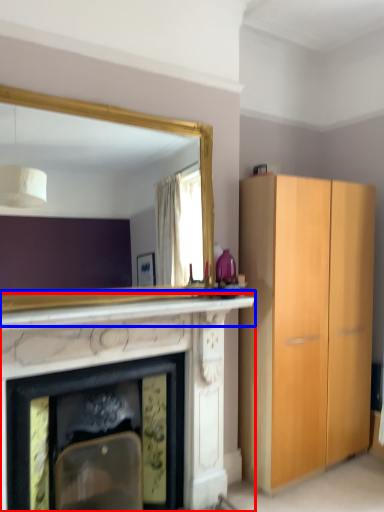
Question: Among these objects, which one is farthest to the camera, fireplace (highlighted by a red box) or mantle (highlighted by a blue box)?

Choices:
 (A) fireplace
 (B) mantle

Answer: (A)